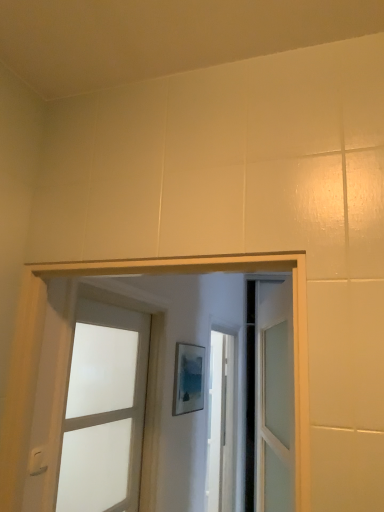
Question: Is white frosted glass door at center wider or thinner than white plastic light switch at lower left?

Choices:
 (A) thin
 (B) wide

Answer: (B)

Question: From the image's perspective, is white frosted glass door at center positioned above or below white plastic light switch at lower left?

Choices:
 (A) above
 (B) below

Answer: (B)

Question: Relative to white plastic light switch at lower left, is white frosted glass door at center in front or behind?

Choices:
 (A) front
 (B) behind

Answer: (B)

Question: From their relative heights in the image, would you say white plastic light switch at lower left is taller or shorter than white frosted glass door at center?

Choices:
 (A) short
 (B) tall

Answer: (A)

Question: Relative to white frosted glass door at center, is white plastic light switch at lower left in front or behind?

Choices:
 (A) front
 (B) behind

Answer: (A)

Question: Does point (31, 467) appear closer or farther from the camera than point (130, 425)?

Choices:
 (A) closer
 (B) farther

Answer: (A)

Question: Considering the relative positions of white plastic light switch at lower left and white frosted glass door at center in the image provided, is white plastic light switch at lower left to the left or to the right of white frosted glass door at center?

Choices:
 (A) left
 (B) right

Answer: (A)